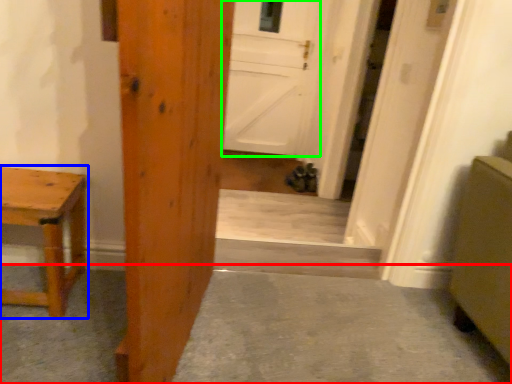
Question: Estimate the real-world distances between objects in this image. Which object is closer to concrete (highlighted by a red box), table (highlighted by a blue box) or door (highlighted by a green box)?

Choices:
 (A) table
 (B) door

Answer: (A)